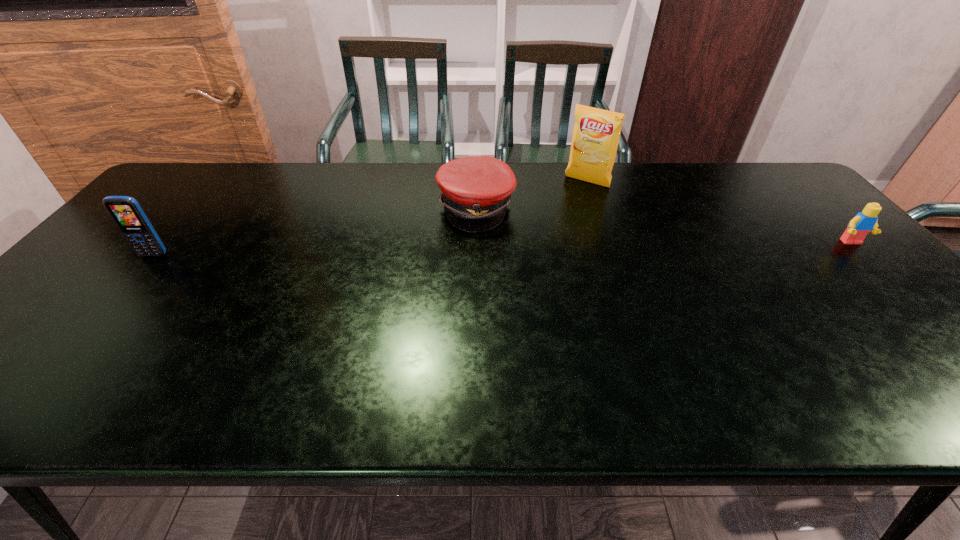
In the image, there is a desktop. Where is `vacant space at the right edge`? vacant space at the right edge is located at coordinates (890, 320).

The image size is (960, 540). In order to click on vacant space in between the crisp (potato chip) and the cap in this screenshot , I will do `click(532, 195)`.

The image size is (960, 540). What are the coordinates of `vacant space that is in between the tallest object and the third shortest object` in the screenshot? It's located at (371, 218).

This screenshot has width=960, height=540. I want to click on vacant area that lies between the second object from left to right and the nearest object, so click(x=315, y=231).

Locate an element on the screen. The image size is (960, 540). vacant space in between the third object from right to left and the leftmost object is located at coordinates (315, 231).

The width and height of the screenshot is (960, 540). What are the coordinates of `free point between the second object from left to right and the crisp (potato chip)` in the screenshot? It's located at (532, 195).

Image resolution: width=960 pixels, height=540 pixels. In order to click on free point between the cellular telephone and the cap in this screenshot , I will do 315,231.

The height and width of the screenshot is (540, 960). Identify the location of vacant area that lies between the third object from right to left and the cellular telephone. (315, 231).

Find the location of a particular element. This screenshot has width=960, height=540. free space that is in between the crisp (potato chip) and the cap is located at coordinates (532, 195).

You are a GUI agent. You are given a task and a screenshot of the screen. Output one action in this format:
    pyautogui.click(x=<x>, y=<y>)
    Task: Click on the vacant area that lies between the cap and the Lego
    Image resolution: width=960 pixels, height=540 pixels.
    Given the screenshot: What is the action you would take?
    pyautogui.click(x=663, y=225)